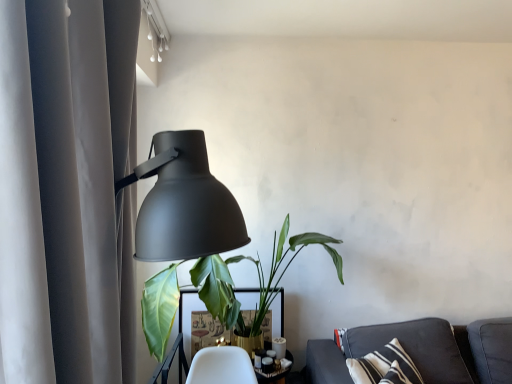
Question: Considering the positions of dark gray fabric couch at lower right and white glossy table at center in the image, is dark gray fabric couch at lower right bigger or smaller than white glossy table at center?

Choices:
 (A) small
 (B) big

Answer: (B)

Question: Would you say dark gray fabric couch at lower right is to the left or to the right of white glossy table at center in the picture?

Choices:
 (A) left
 (B) right

Answer: (B)

Question: Based on their relative distances, which object is nearer to the green leafy plant at center?

Choices:
 (A) matte black lamp at left
 (B) matte gray curtain at left
 (C) white glossy table at center
 (D) dark gray fabric couch at lower right

Answer: (A)

Question: Which object is the farthest from the green leafy plant at center?

Choices:
 (A) matte gray curtain at left
 (B) dark gray fabric couch at lower right
 (C) matte black lamp at left
 (D) white glossy table at center

Answer: (A)